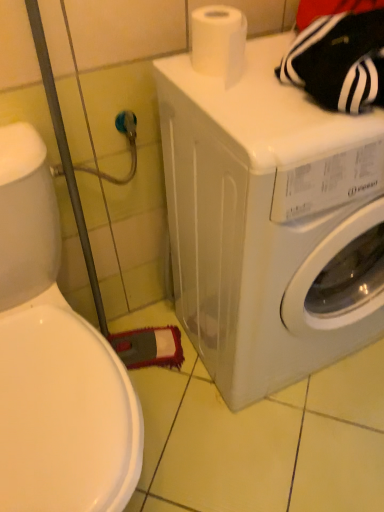
Question: Should I look upward or downward to see white matte toilet paper at upper center?

Choices:
 (A) up
 (B) down

Answer: (A)

Question: Can you confirm if white matte toilet paper at upper center is thinner than white plastic washing machine at center?

Choices:
 (A) no
 (B) yes

Answer: (B)

Question: From a real-world perspective, is white matte toilet paper at upper center positioned under white plastic washing machine at center based on gravity?

Choices:
 (A) yes
 (B) no

Answer: (B)

Question: Is white matte toilet paper at upper center beside white plastic washing machine at center?

Choices:
 (A) yes
 (B) no

Answer: (B)

Question: Is white matte toilet paper at upper center positioned before white plastic washing machine at center?

Choices:
 (A) no
 (B) yes

Answer: (A)

Question: Considering the relative sizes of white matte toilet paper at upper center and white plastic washing machine at center in the image provided, is white matte toilet paper at upper center smaller than white plastic washing machine at center?

Choices:
 (A) no
 (B) yes

Answer: (B)

Question: From a real-world perspective, is white matte toilet paper at upper center on top of white plastic washing machine at center?

Choices:
 (A) yes
 (B) no

Answer: (A)

Question: Is white plastic washing machine at center aimed at white matte toilet paper at upper center?

Choices:
 (A) yes
 (B) no

Answer: (B)

Question: From the image's perspective, is white plastic washing machine at center above white matte toilet paper at upper center?

Choices:
 (A) no
 (B) yes

Answer: (A)

Question: Is white plastic washing machine at center thinner than white matte toilet paper at upper center?

Choices:
 (A) no
 (B) yes

Answer: (A)

Question: Can you confirm if white plastic washing machine at center is bigger than white matte toilet paper at upper center?

Choices:
 (A) no
 (B) yes

Answer: (B)

Question: From a real-world perspective, is white plastic washing machine at center beneath white matte toilet paper at upper center?

Choices:
 (A) yes
 (B) no

Answer: (A)

Question: From a real-world perspective, does white plastic washing machine at center stand above white matte toilet paper at upper center?

Choices:
 (A) no
 (B) yes

Answer: (A)

Question: From a real-world perspective, is white matte toilet paper at upper center above or below white plastic washing machine at center?

Choices:
 (A) above
 (B) below

Answer: (A)